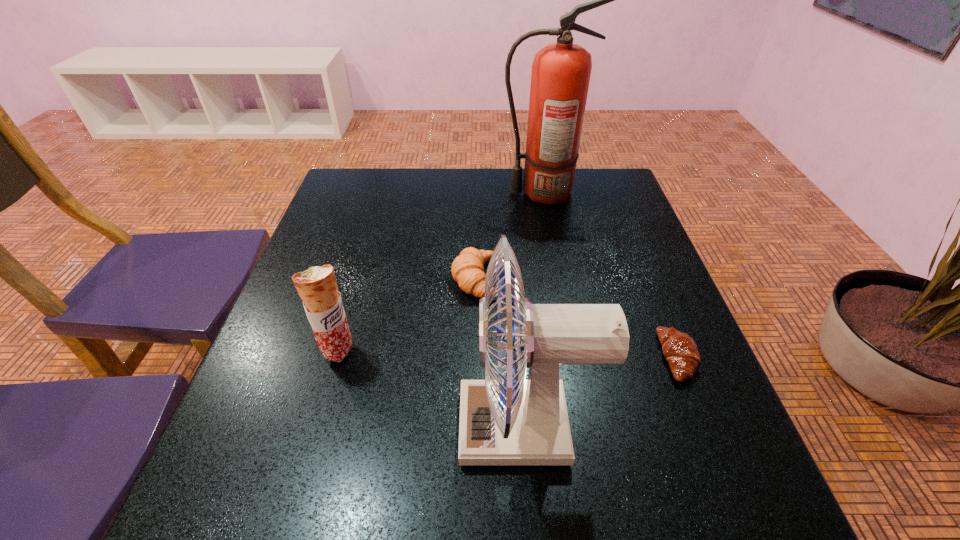
At what (x,y) coordinates should I click in order to perform the action: click on free space located on the nozzle of the tallest object. Please return your answer as a coordinate pair (x, y). Image resolution: width=960 pixels, height=540 pixels. Looking at the image, I should click on (450, 192).

You are a GUI agent. You are given a task and a screenshot of the screen. Output one action in this format:
    pyautogui.click(x=<x>, y=<y>)
    Task: Click on the blank space located 0.260m on the nozzle of the tallest object
    
    Given the screenshot: What is the action you would take?
    pyautogui.click(x=413, y=192)

At what (x,y) coordinates should I click in order to perform the action: click on blank area located on the front-facing side of the second tallest object. Please return your answer as a coordinate pair (x, y). This screenshot has width=960, height=540. Looking at the image, I should click on (333, 426).

This screenshot has width=960, height=540. Find the location of `vacant area situated 0.350m on the front-facing side of the second tallest object`. vacant area situated 0.350m on the front-facing side of the second tallest object is located at coordinates (257, 426).

Find the location of a particular element. The width and height of the screenshot is (960, 540). free space located 0.250m on the front-facing side of the second tallest object is located at coordinates (315, 426).

At what (x,y) coordinates should I click in order to perform the action: click on vacant space located on the left of the leftmost object. Please return your answer as a coordinate pair (x, y). This screenshot has width=960, height=540. Looking at the image, I should click on (271, 351).

Where is `vacant space located 0.170m on the left of the left crescent roll`? The height and width of the screenshot is (540, 960). vacant space located 0.170m on the left of the left crescent roll is located at coordinates (379, 279).

I want to click on free spot located on the left of the nearer crescent roll, so click(589, 357).

You are a GUI agent. You are given a task and a screenshot of the screen. Output one action in this format:
    pyautogui.click(x=<x>, y=<y>)
    Task: Click on the object that is at the far edge
    
    Given the screenshot: What is the action you would take?
    pyautogui.click(x=561, y=71)

The width and height of the screenshot is (960, 540). What are the coordinates of `object located at the near edge` in the screenshot? It's located at (514, 421).